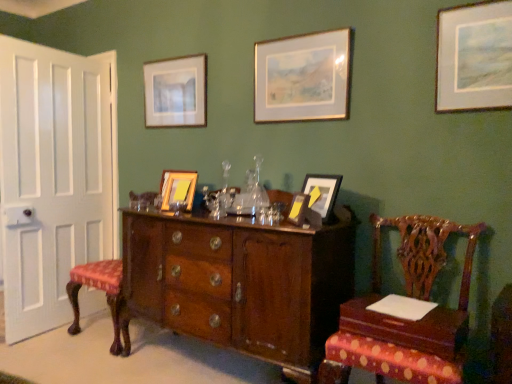
Find the location of a particular element. The image size is (512, 384). free space in front of white wood door at left is located at coordinates (58, 352).